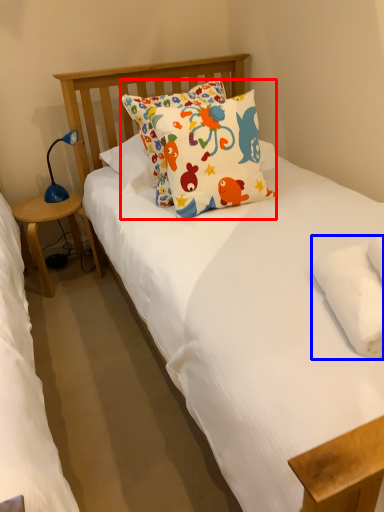
Question: Which of the following is the farthest to the observer, pillow (highlighted by a red box) or pillow (highlighted by a blue box)?

Choices:
 (A) pillow
 (B) pillow

Answer: (A)